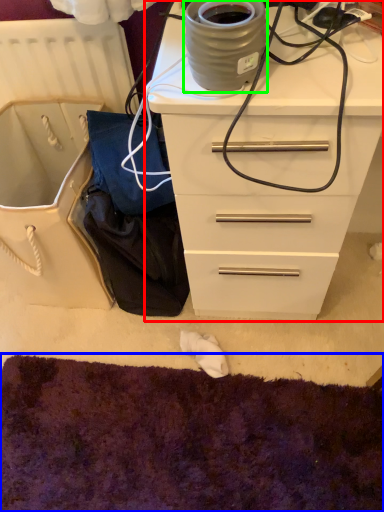
Question: Which object is the closest to the chest of drawers (highlighted by a red box)? Choose among these: cat bed (highlighted by a blue box) or appliance (highlighted by a green box).

Choices:
 (A) cat bed
 (B) appliance

Answer: (B)